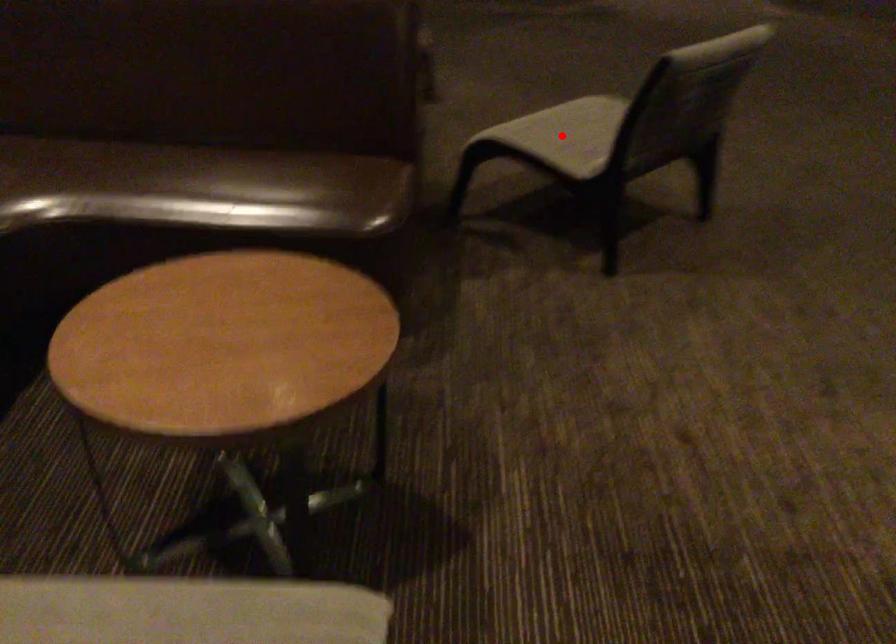
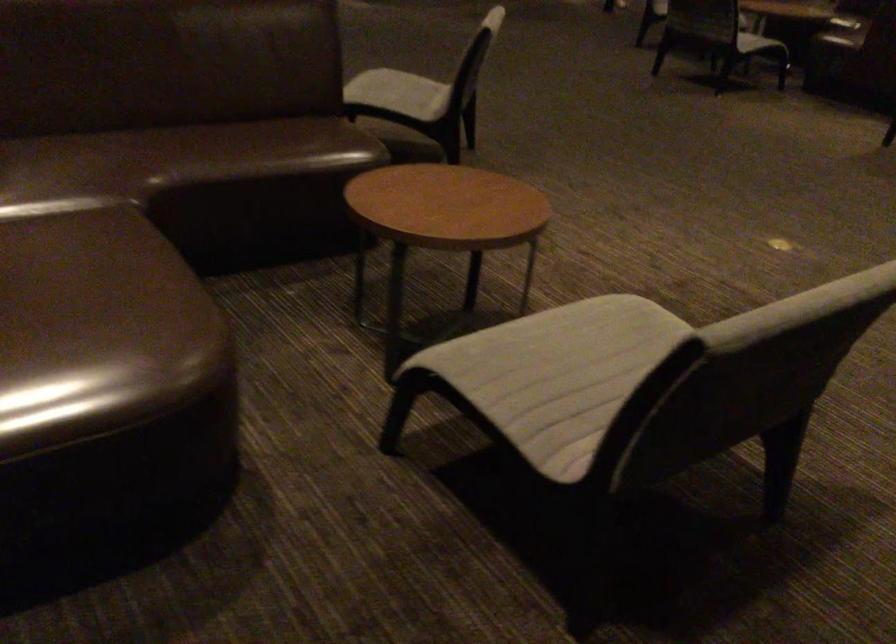
Locate, in the second image, the point that corresponds to the highlighted location in the first image.

(399, 93)